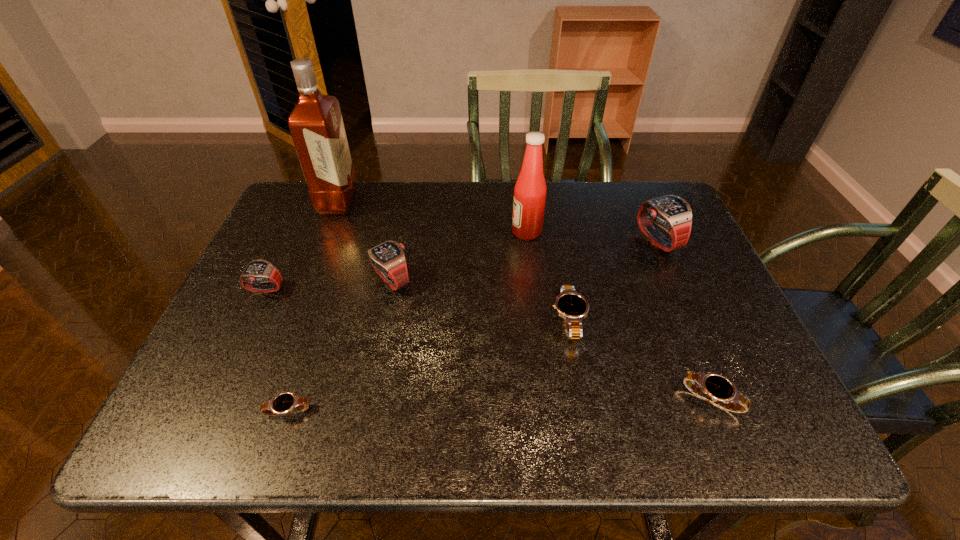
Identify the location of liquor. (316, 125).

Image resolution: width=960 pixels, height=540 pixels. I want to click on the tallest object, so click(316, 125).

The width and height of the screenshot is (960, 540). I want to click on condiment, so click(530, 190).

Locate an element on the screen. the seventh shortest object is located at coordinates click(530, 190).

Where is `the rightmost red watch`? The width and height of the screenshot is (960, 540). the rightmost red watch is located at coordinates (672, 213).

Locate an element on the screen. the tallest watch is located at coordinates (672, 213).

At what (x,y) coordinates should I click in order to perform the action: click on the fourth object from left to right. Please return your answer as a coordinate pair (x, y). The width and height of the screenshot is (960, 540). Looking at the image, I should click on (388, 259).

I want to click on the fourth tallest object, so click(388, 259).

You are a GUI agent. You are given a task and a screenshot of the screen. Output one action in this format:
    pyautogui.click(x=<x>, y=<y>)
    Task: Click on the smallest red watch
    The image size is (960, 540).
    Given the screenshot: What is the action you would take?
    pyautogui.click(x=257, y=271)

This screenshot has width=960, height=540. I want to click on the fourth shortest watch, so click(257, 271).